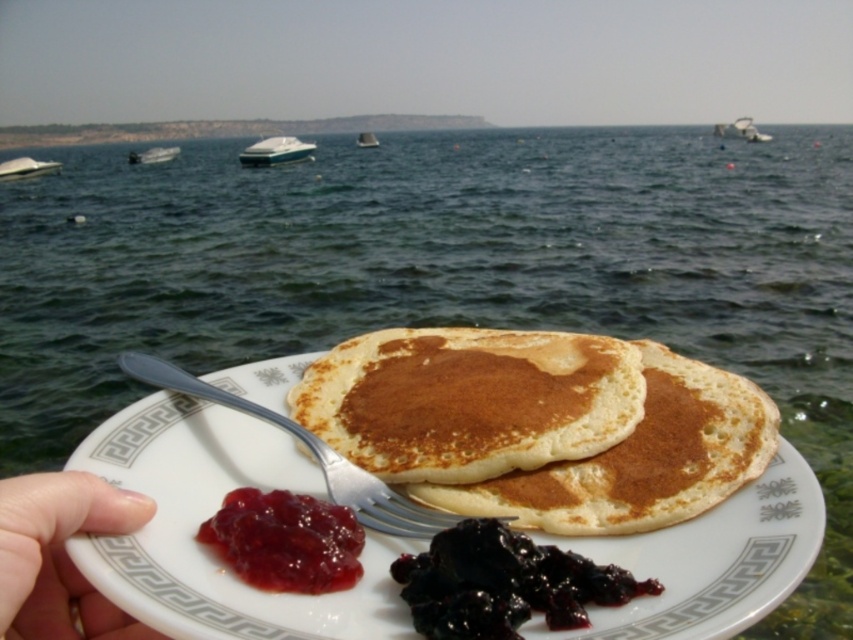
How far apart are golden brown pancake at center and silver metallic fork at lower center?

golden brown pancake at center is 6.22 centimeters from silver metallic fork at lower center.

Between point (317, 429) and point (407, 525), which one is positioned in front?

Point (407, 525) is more forward.

Locate an element on the screen. This screenshot has width=853, height=640. golden brown pancake at center is located at coordinates (469, 401).

Which of these two, white plastic boat at upper right or white plastic boat at center, stands taller?

white plastic boat at upper right is taller.

Which of these two, white plastic boat at upper right or white plastic boat at center, stands shorter?

white plastic boat at center

Find the location of a particular element. The height and width of the screenshot is (640, 853). white plastic boat at upper right is located at coordinates (740, 131).

Between point (720, 444) and point (347, 528), which one is positioned in front?

Point (347, 528) is in front.

Is golden-brown pancake at center thinner than shiny red jam at center?

Incorrect, golden-brown pancake at center's width is not less than shiny red jam at center's.

Who is more forward, (762, 396) or (297, 536)?

Positioned in front is point (297, 536).

The image size is (853, 640). Identify the location of golden-brown pancake at center. (639, 460).